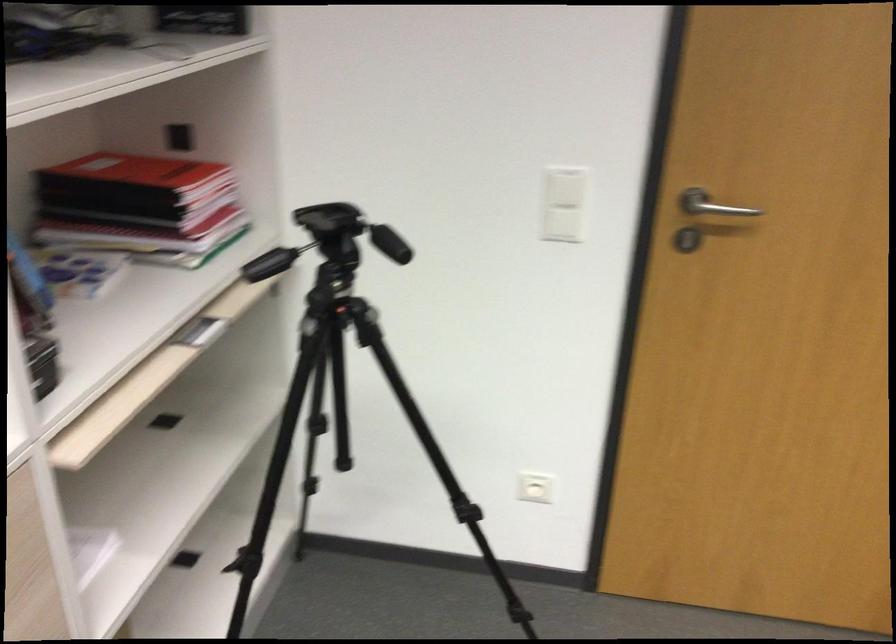
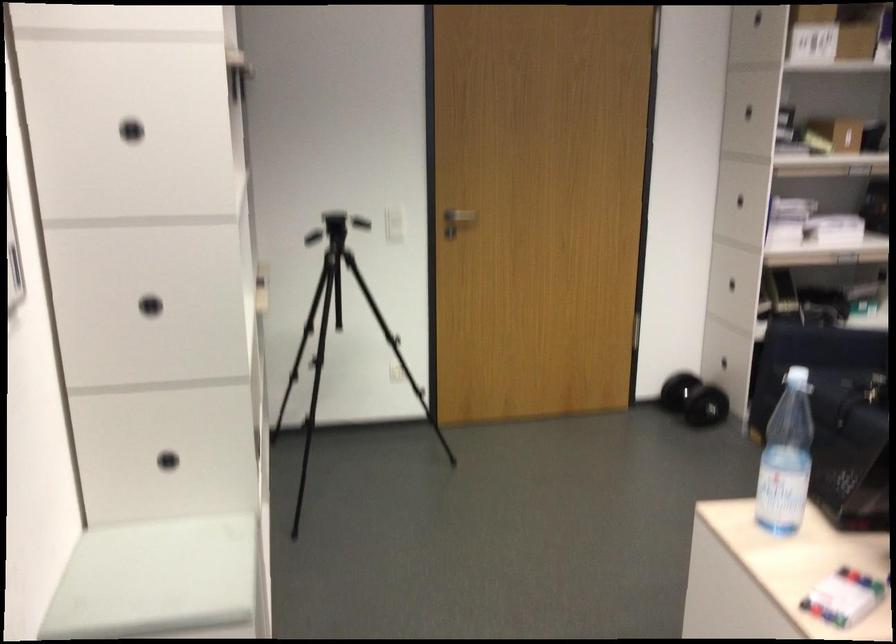
Question: I am providing you with two images of the same scene from different viewpoints. Please identify which objects are invisible in image2.

Choices:
 (A) black dumbbell
 (B) red notebook
 (C) yellow toy handle
 (D) plastic water bottle

Answer: (B)